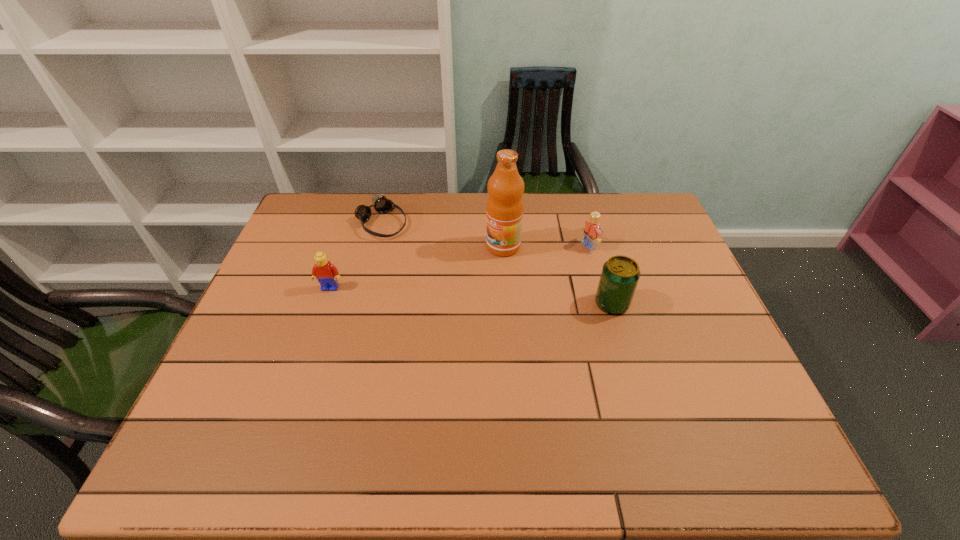
At what (x,y) coordinates should I click in order to perform the action: click on unoccupied position between the left Lego and the beer can. Please return your answer as a coordinate pair (x, y). Looking at the image, I should click on (471, 296).

At what (x,y) coordinates should I click in order to perform the action: click on unoccupied area between the fruit juice and the nearer Lego. Please return your answer as a coordinate pair (x, y). Looking at the image, I should click on (417, 267).

The height and width of the screenshot is (540, 960). Identify the location of free space between the beer can and the farther Lego. (601, 275).

The image size is (960, 540). Find the location of `blank region between the nearer Lego and the beer can`. blank region between the nearer Lego and the beer can is located at coordinates (471, 296).

Where is `vacant area between the third object from left to right and the nearer Lego`? vacant area between the third object from left to right and the nearer Lego is located at coordinates (417, 267).

Locate an element on the screen. the third closest object to the nearer Lego is located at coordinates (620, 274).

Select which object appears as the fourth closest to the right Lego. Please provide its 2D coordinates. Your answer should be formatted as a tuple, i.e. [(x, y)], where the tuple contains the x and y coordinates of a point satisfying the conditions above.

[(326, 273)]

Where is `blank area in the image that satisfies the following two spatial constraints: 1. on the front side of the third object from right to left; 2. on the left side of the goggles`? blank area in the image that satisfies the following two spatial constraints: 1. on the front side of the third object from right to left; 2. on the left side of the goggles is located at coordinates (375, 246).

This screenshot has height=540, width=960. What are the coordinates of `vacant region that satisfies the following two spatial constraints: 1. on the front-facing side of the beer can; 2. on the left side of the left Lego` in the screenshot? It's located at (324, 303).

Image resolution: width=960 pixels, height=540 pixels. In order to click on free space that satisfies the following two spatial constraints: 1. on the front side of the fruit juice; 2. on the right side of the goggles in this screenshot , I will do `click(375, 246)`.